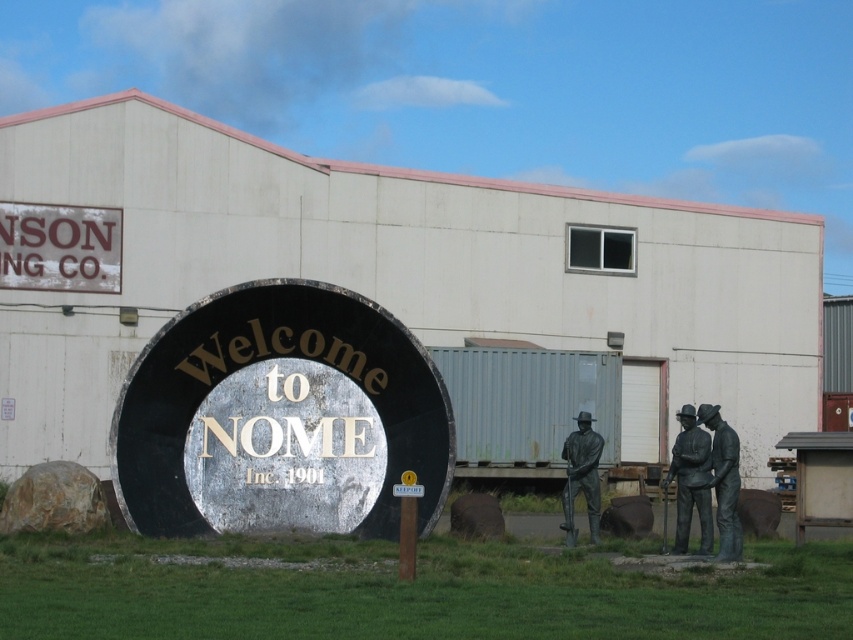
Question: Among these points, which one is nearest to the camera?

Choices:
 (A) (428, 456)
 (B) (706, 504)
 (C) (103, 284)
 (D) (718, 532)

Answer: (D)

Question: Which object is closer to the camera taking this photo?

Choices:
 (A) bronze statue at right
 (B) rustic brown sign at upper left
 (C) polished bronze statue at center

Answer: (A)

Question: Which of these objects is positioned closest to the polished bronze statue at center?

Choices:
 (A) bronze statue at center
 (B) rustic brown sign at upper left
 (C) bronze statue at right
 (D) metallic silver sign at center

Answer: (A)

Question: Does bronze statue at right have a lesser width compared to bronze statue at center?

Choices:
 (A) no
 (B) yes

Answer: (B)

Question: Does polished bronze statue at center appear on the right side of bronze statue at center?

Choices:
 (A) yes
 (B) no

Answer: (A)

Question: Can you confirm if metallic silver sign at center is smaller than polished bronze statue at center?

Choices:
 (A) no
 (B) yes

Answer: (B)